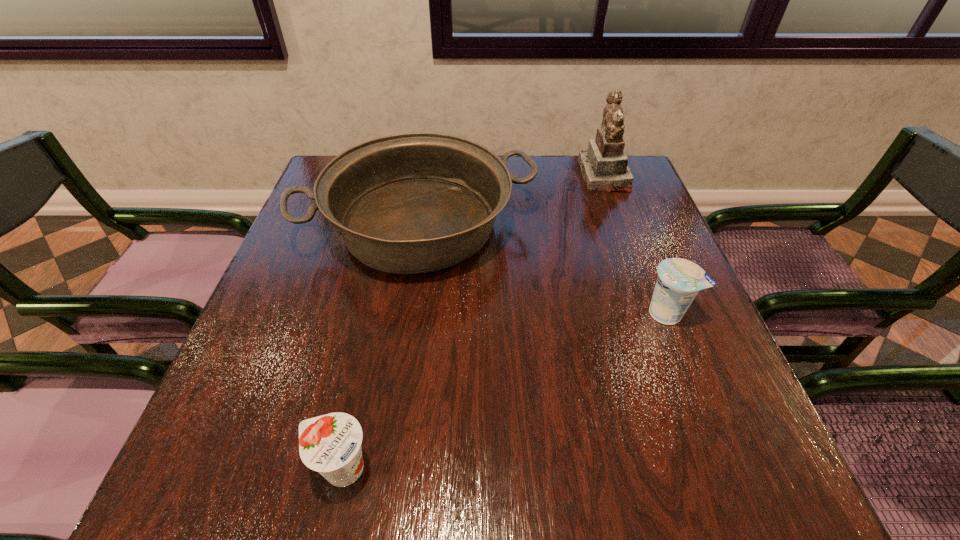
I want to click on vacant space in between the shortest object and the pan, so click(381, 347).

Find the location of `vacant area that lies between the third shortest object and the figurine`. vacant area that lies between the third shortest object and the figurine is located at coordinates (512, 201).

The width and height of the screenshot is (960, 540). Identify the location of empty space that is in between the pan and the figurine. (512, 201).

Where is `vacant area between the nearest object and the farther yogurt`? Image resolution: width=960 pixels, height=540 pixels. vacant area between the nearest object and the farther yogurt is located at coordinates [505, 391].

This screenshot has width=960, height=540. Identify the location of vacant space in between the third tallest object and the figurine. (636, 245).

At what (x,y) coordinates should I click in order to perform the action: click on object that is the third closest to the tallest object. Please return your answer as a coordinate pair (x, y). This screenshot has height=540, width=960. Looking at the image, I should click on (331, 444).

Identify the location of object that is the closest to the third shortest object. The height and width of the screenshot is (540, 960). (604, 166).

Locate an element on the screen. free space that satisfies the following two spatial constraints: 1. on the front-facing side of the farther yogurt; 2. on the left side of the figurine is located at coordinates click(655, 313).

You are a GUI agent. You are given a task and a screenshot of the screen. Output one action in this format:
    pyautogui.click(x=<x>, y=<y>)
    Task: Click on the vacant space that satisfies the following two spatial constraints: 1. on the front-facing side of the taller yogurt; 2. on the right side of the tallest object
    Image resolution: width=960 pixels, height=540 pixels.
    Given the screenshot: What is the action you would take?
    pyautogui.click(x=655, y=313)

At what (x,y) coordinates should I click in order to perform the action: click on vacant area that satisfies the following two spatial constraints: 1. on the front-facing side of the farther yogurt; 2. on the left side of the figurine. Please return your answer as a coordinate pair (x, y). Looking at the image, I should click on (655, 313).